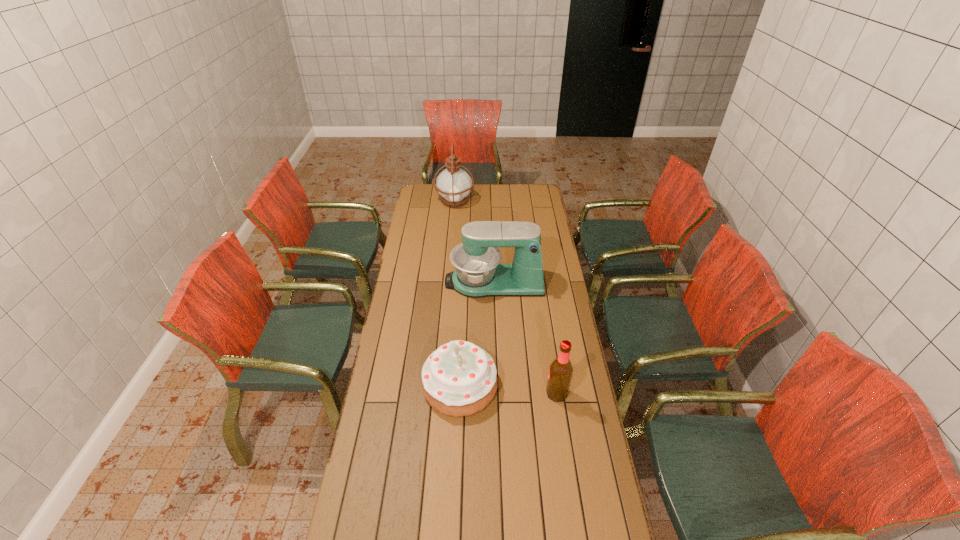
Where is `oil lamp`? oil lamp is located at coordinates (453, 184).

The image size is (960, 540). Identify the location of the tallest object. (453, 184).

Locate an element on the screen. The image size is (960, 540). the third nearest object is located at coordinates (477, 274).

Find the location of a particular element. beer bottle is located at coordinates (560, 373).

This screenshot has width=960, height=540. Find the location of `cake`. cake is located at coordinates (459, 378).

Find the location of a particular element. The width and height of the screenshot is (960, 540). free space located 0.270m on the front of the tallest object is located at coordinates (450, 240).

Image resolution: width=960 pixels, height=540 pixels. What are the coordinates of `vacant space situated 0.140m on the front-facing side of the mixer` in the screenshot? It's located at (416, 282).

Find the location of a particular element. The image size is (960, 540). vacant space located 0.190m on the front-facing side of the mixer is located at coordinates (405, 282).

You are a GUI agent. You are given a task and a screenshot of the screen. Output one action in this format:
    pyautogui.click(x=<x>, y=<y>)
    Task: Click on the vacant space located on the front-facing side of the mixer
    
    Given the screenshot: What is the action you would take?
    pyautogui.click(x=435, y=282)

The height and width of the screenshot is (540, 960). Find the location of `vacant region located on the back of the beer bottle`. vacant region located on the back of the beer bottle is located at coordinates (548, 339).